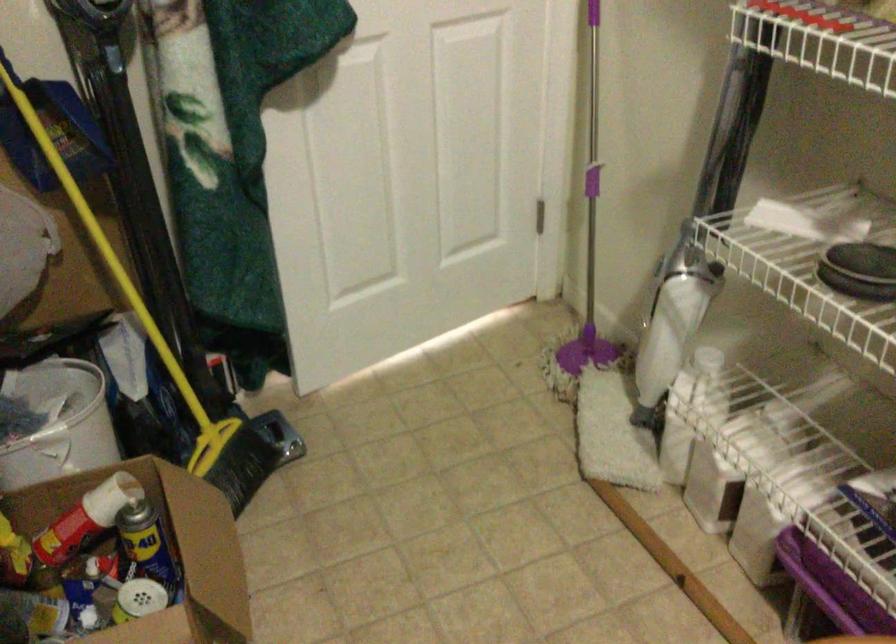
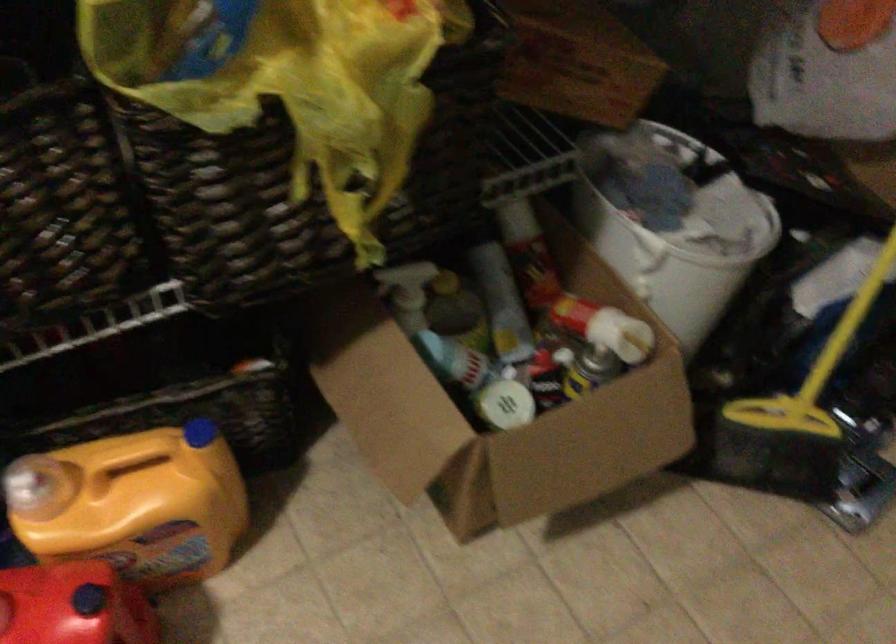
The point at (179,366) is marked in the first image. Where is the corresponding point in the second image?

(849, 323)